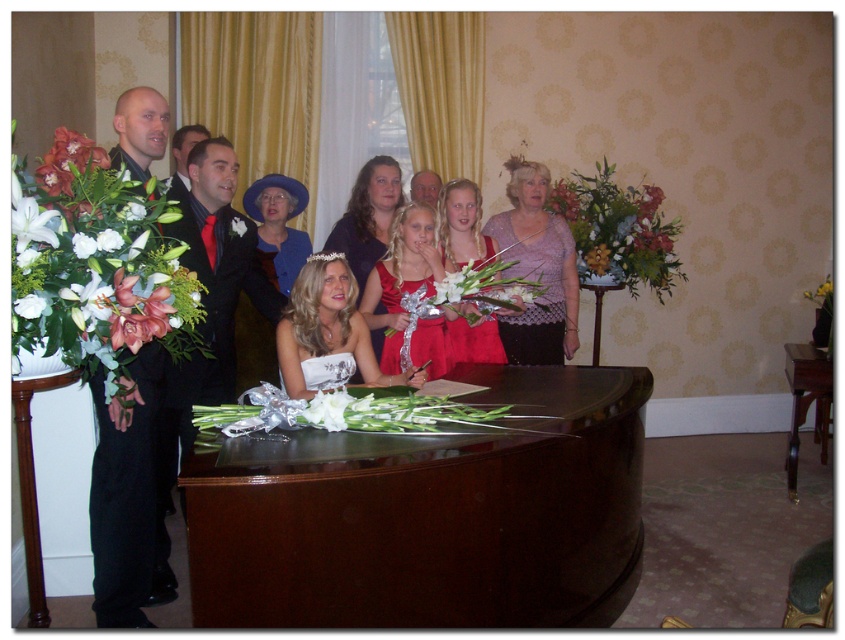
Question: Does matte silver tiara at center appear on the right side of shiny satin dress at center?

Choices:
 (A) no
 (B) yes

Answer: (A)

Question: Considering the real-world distances, which object is closest to the matte black dress at center?

Choices:
 (A) matte red dress at center
 (B) black satin suit at left
 (C) brown wooden table at lower right
 (D) white silk flower at center

Answer: (A)

Question: Which object is positioned farthest from the shiny black suit at center?

Choices:
 (A) lace fabric dress at center
 (B) matte red dress at center

Answer: (A)

Question: Is black satin suit at left bigger than white silk flower at center?

Choices:
 (A) yes
 (B) no

Answer: (A)

Question: Does velvet blue coat at center appear over shiny satin dress at center?

Choices:
 (A) no
 (B) yes

Answer: (B)

Question: Estimate the real-world distances between objects in this image. Which object is closer to the velvet blue coat at center?

Choices:
 (A) shiny satin dress at center
 (B) matte silver tiara at center

Answer: (A)